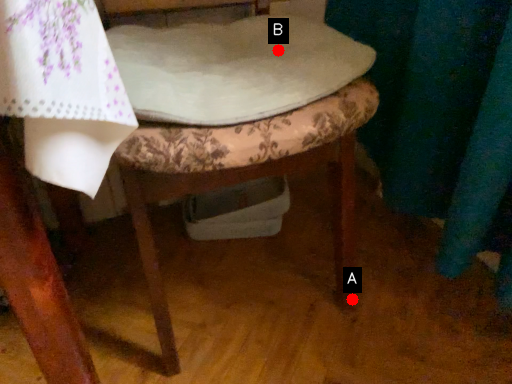
Question: Two points are circled on the image, labeled by A and B beside each circle. Which point is closer to the camera taking this photo?

Choices:
 (A) A is closer
 (B) B is closer

Answer: (B)